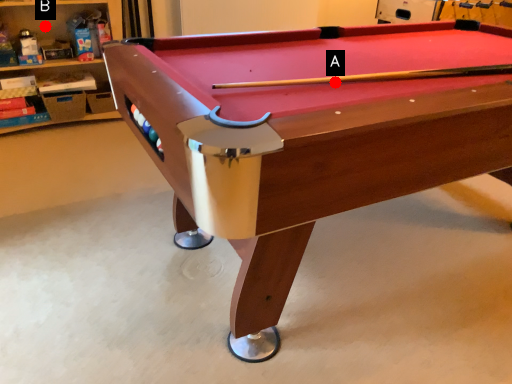
Question: Two points are circled on the image, labeled by A and B beside each circle. Which of the following is the closest to the observer?

Choices:
 (A) A is closer
 (B) B is closer

Answer: (A)